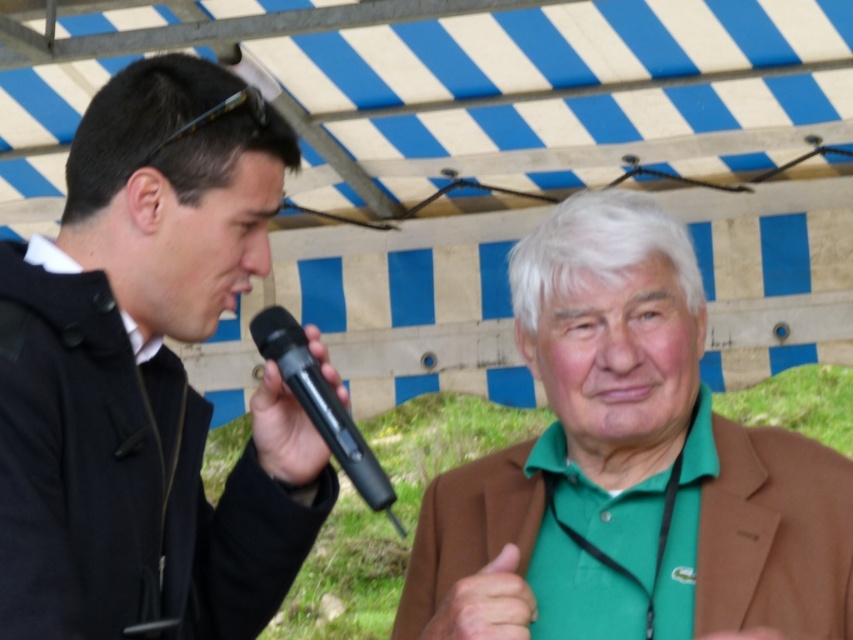
You are a photographer positioned to the right of the scene. You want to capture a photo where both the black matte jacket at left and the black plastic microphone at center are visible. Which object should you adjust your camera angle to focus on first to ensure both are in frame?

The black matte jacket at left is to the left of the black plastic microphone at center, so you should adjust your camera angle to focus on the black matte jacket at left first to ensure both are in frame.

From the picture: You are organizing a photo shoot and need to ensure that all props and clothing items are appropriately sized. Based on the scene, which object is larger in size between the green fabric shirt at right and the black plastic microphone at left?

The green fabric shirt at right is larger in size compared to the black plastic microphone at left according to the description.